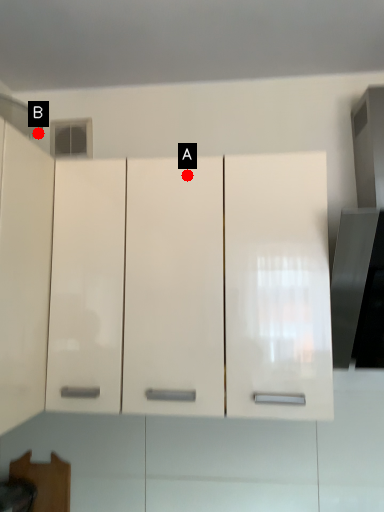
Question: Two points are circled on the image, labeled by A and B beside each circle. Which point is further to the camera?

Choices:
 (A) A is further
 (B) B is further

Answer: (B)